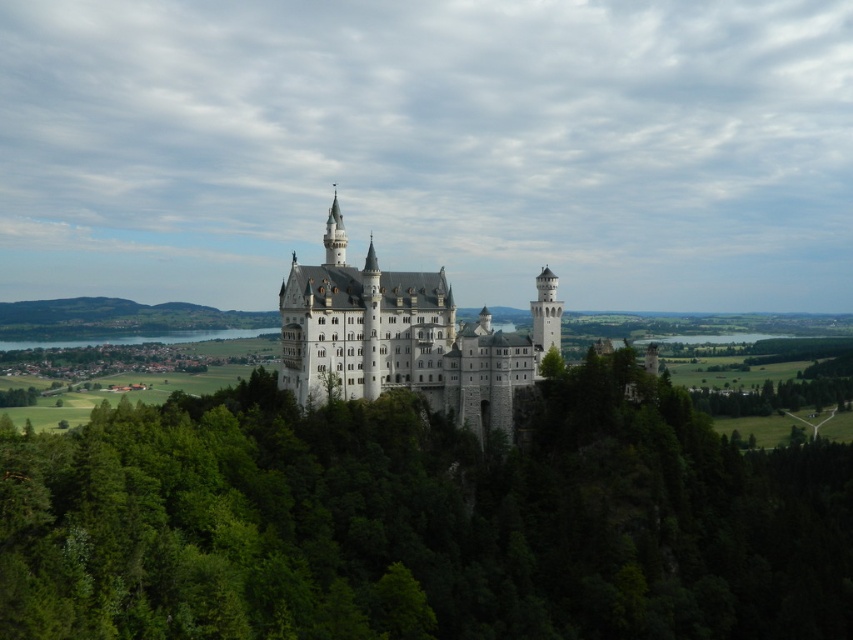
Question: Which object appears closest to the camera in this image?

Choices:
 (A) green leafy trees at center
 (B) white stone castle at center

Answer: (A)

Question: Is green leafy trees at center wider than white stone castle at center?

Choices:
 (A) yes
 (B) no

Answer: (A)

Question: Which point is closer to the camera?

Choices:
 (A) (231, 458)
 (B) (526, 340)

Answer: (A)

Question: Does green leafy trees at center appear under white stone castle at center?

Choices:
 (A) yes
 (B) no

Answer: (A)

Question: Is green leafy trees at center bigger than white stone castle at center?

Choices:
 (A) no
 (B) yes

Answer: (B)